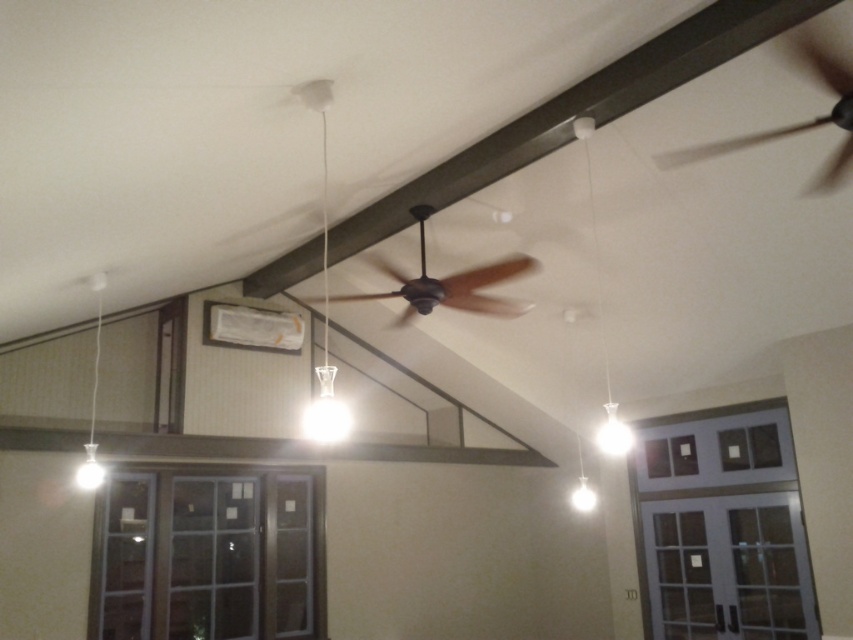
You are an interior designer planning to install a new light fixture in this room. You have two options available to you. The first is the brown matte fan at center, and the second is the white glass pendant light at left. Which of these two options would you choose if you want a larger fixture to illuminate a specific area more effectively?

The white glass pendant light at left is larger than the brown matte fan at center, so it would be the better choice for illuminating a specific area more effectively.

You are standing in the room and want to hang a picture frame between the two points, point (845, 83) and point (450, 304). Which point is closer to you where you should start measuring from?

Point (845, 83) is closer to the camera than point (450, 304), so you should start measuring from point (845, 83).

In the scene shown: You are a painter standing on a ladder in the room. You need to paint the ceiling but want to avoid getting paint on the brown matte fan at center and the white glass pendant light at left. Which object is closer to you so you can prioritize painting around it first?

The brown matte fan at center is 5.97 feet away from the white glass pendant light at left, so you need to consider their positions. Since both are hanging from the ceiling, their distance from you depends on your location. However, without knowing your exact position, it is impossible to determine which is closer.